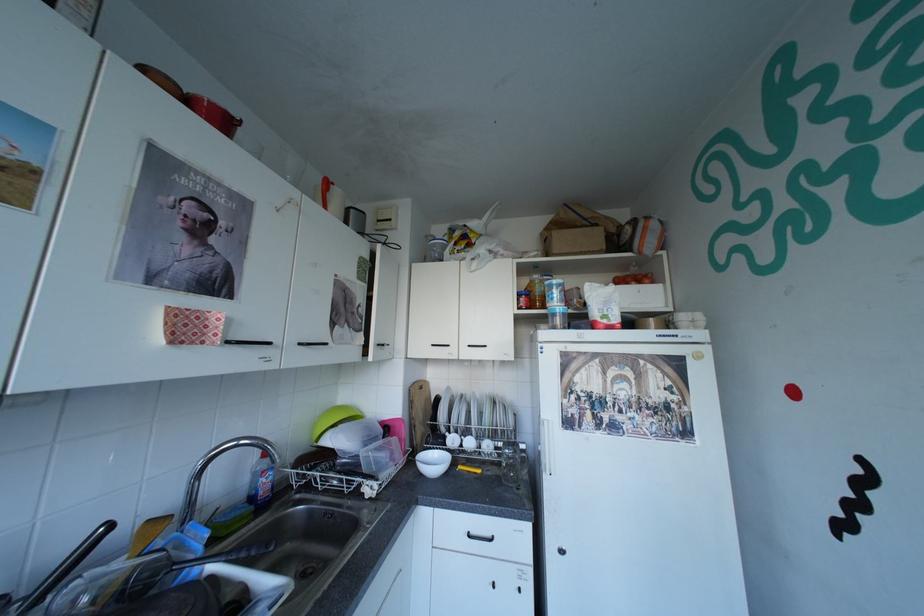
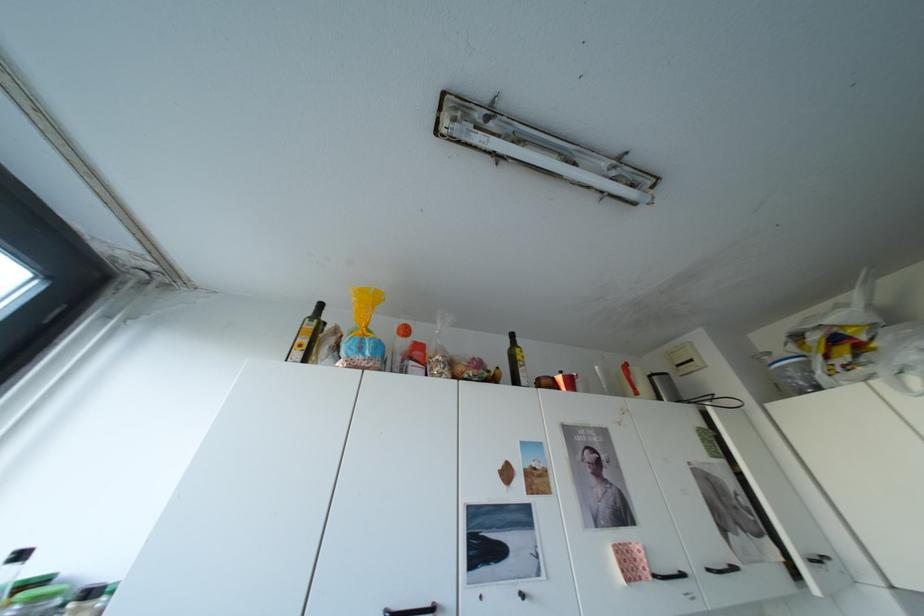
Find the pixel in the second image that matches pixel 392 345 in the first image.

(824, 561)